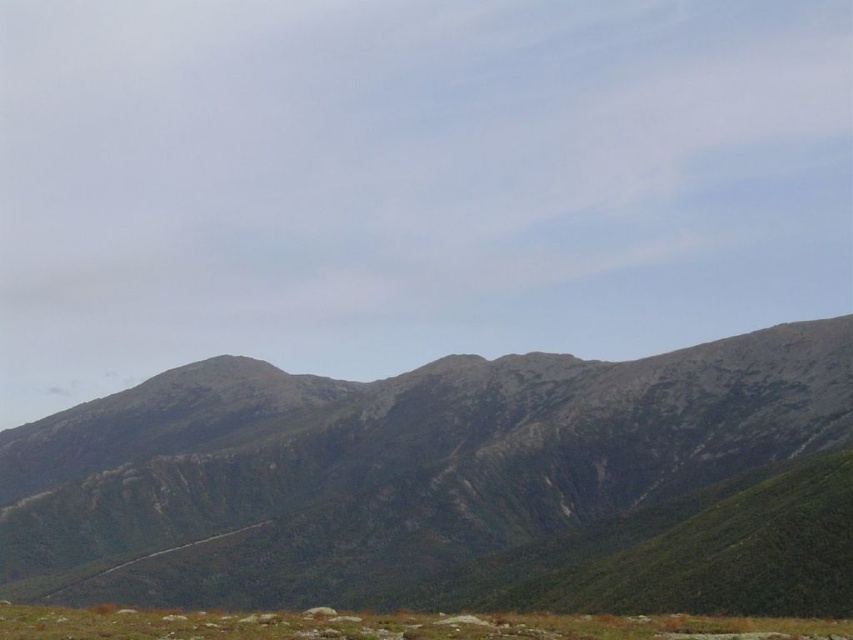
Which is above, rugged gray rock at center or green grassy at lower center?

Positioned higher is green grassy at lower center.

Can you confirm if rugged gray rock at center is taller than green grassy at lower center?

Correct, rugged gray rock at center is much taller as green grassy at lower center.

Does point (506, 509) come in front of point (666, 634)?

No.

Identify the location of rugged gray rock at center. This screenshot has height=640, width=853. click(387, 465).